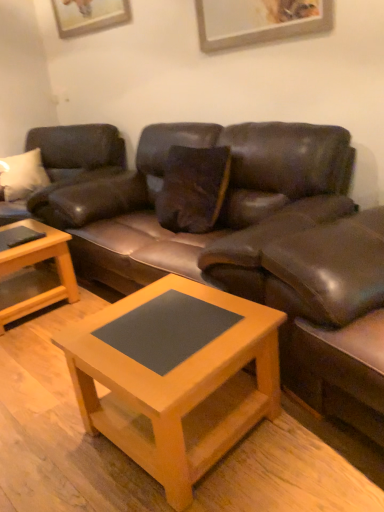
Where is `free space to the left of matte wood coffee table at center, the first coffee table viewed from the right`? The width and height of the screenshot is (384, 512). free space to the left of matte wood coffee table at center, the first coffee table viewed from the right is located at coordinates (49, 446).